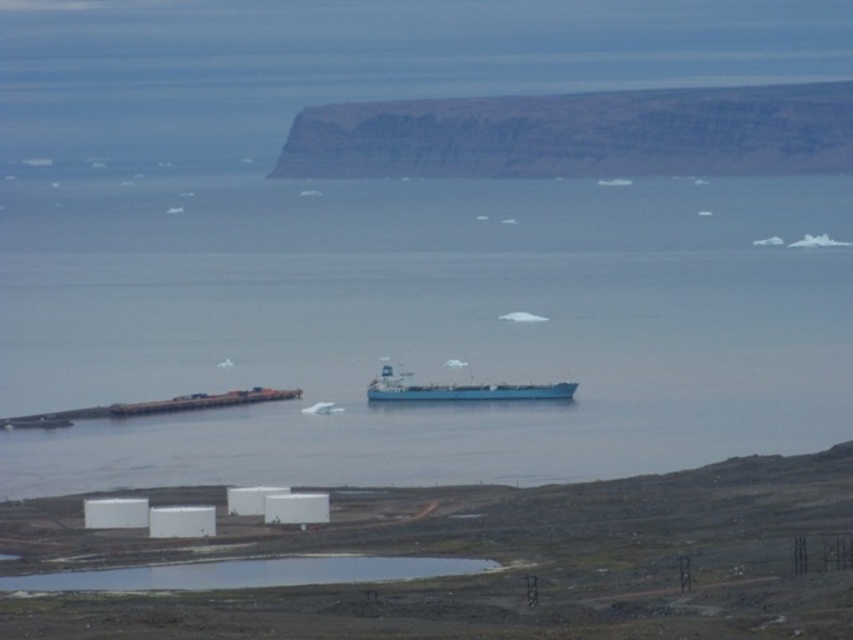
Question: Does blue water at center appear over blue matte ship at center?

Choices:
 (A) yes
 (B) no

Answer: (A)

Question: Is rocky cliff at upper center to the left of blue matte ship at center from the viewer's perspective?

Choices:
 (A) yes
 (B) no

Answer: (B)

Question: Which point is farther to the camera?

Choices:
 (A) (466, 397)
 (B) (519, 147)
 (C) (270, 609)

Answer: (C)

Question: Does white matte containers at lower center appear under rocky cliff at upper center?

Choices:
 (A) no
 (B) yes

Answer: (B)

Question: Which point appears farthest from the camera in this image?

Choices:
 (A) (437, 636)
 (B) (412, 138)
 (C) (548, 464)
 (D) (480, 396)

Answer: (A)

Question: Which point is farther to the camera?

Choices:
 (A) (839, 113)
 (B) (538, 275)
 (C) (393, 381)

Answer: (A)